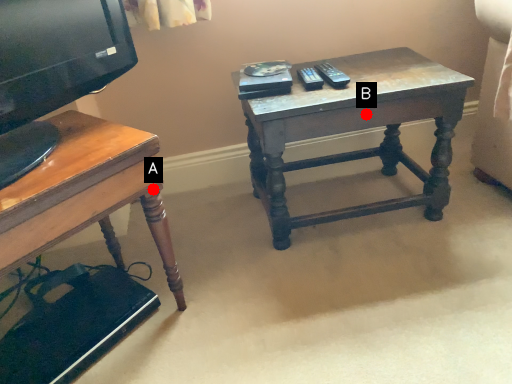
Question: Two points are circled on the image, labeled by A and B beside each circle. Which point is farther to the camera?

Choices:
 (A) A is further
 (B) B is further

Answer: (B)